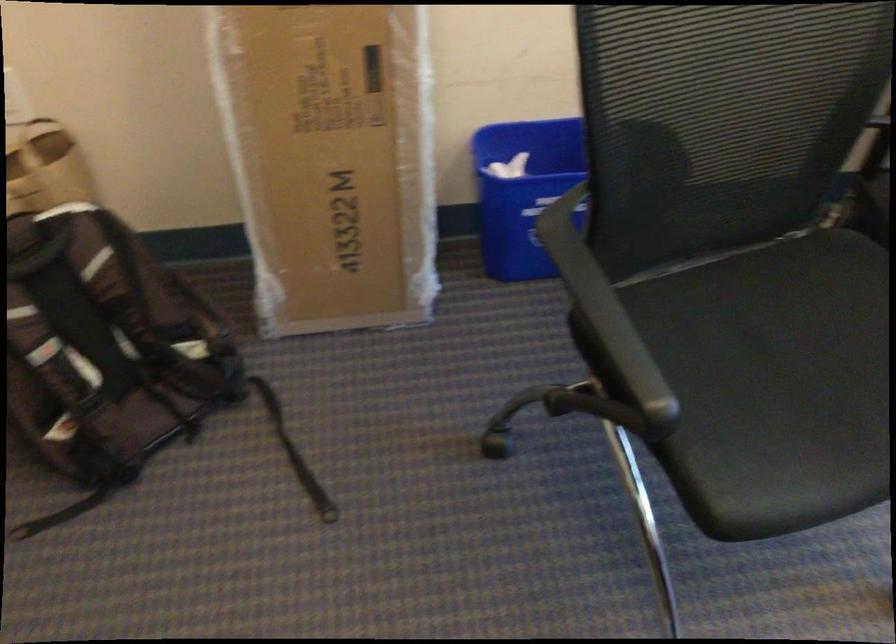
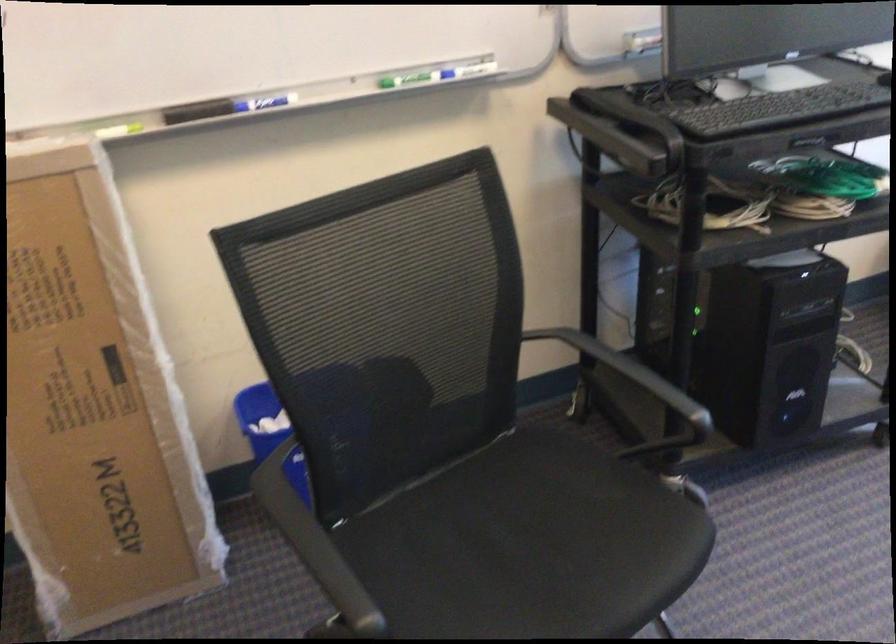
Question: I am providing you with two images of the same scene from different viewpoints. Please identify which objects are invisible in image2.

Choices:
 (A) black chair sitting surface
 (B) black whiteboard eraser
 (C) black chair armrest
 (D) none of these

Answer: (D)